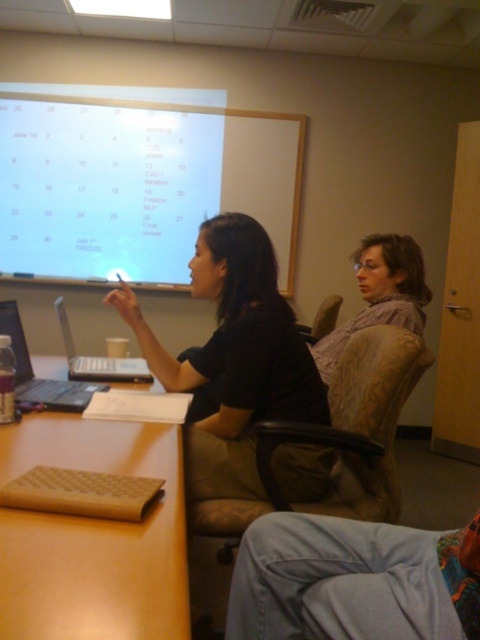
Question: Does white matte projection screen at upper center appear under matte black laptop at left?

Choices:
 (A) no
 (B) yes

Answer: (A)

Question: Which of these objects is positioned farthest from the matte black laptop at left?

Choices:
 (A) silver metallic laptop at center
 (B) white matte projection screen at upper center
 (C) black matte shirt at center

Answer: (B)

Question: Where is black matte shirt at center located in relation to matte black laptop at left in the image?

Choices:
 (A) left
 (B) right

Answer: (B)

Question: Can you confirm if matte black laptop at left is positioned to the left of silver metallic laptop at center?

Choices:
 (A) yes
 (B) no

Answer: (A)

Question: Among these objects, which one is farthest from the camera?

Choices:
 (A) matte black laptop at left
 (B) brown leather table at center
 (C) white matte projection screen at upper center

Answer: (C)

Question: Which object is positioned farthest from the white matte projection screen at upper center?

Choices:
 (A) light brown fabric chair at right
 (B) brown leather table at center
 (C) matte black laptop at left

Answer: (B)